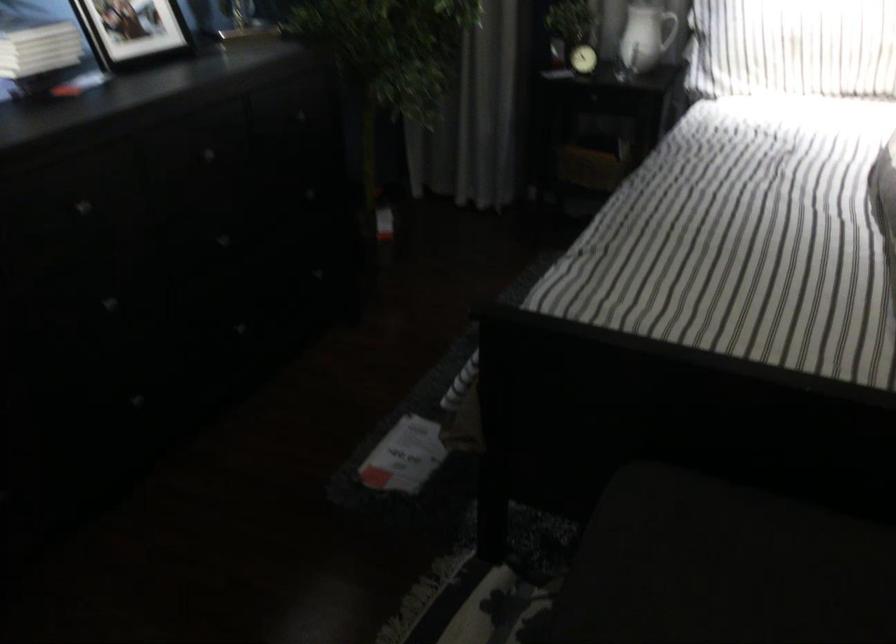
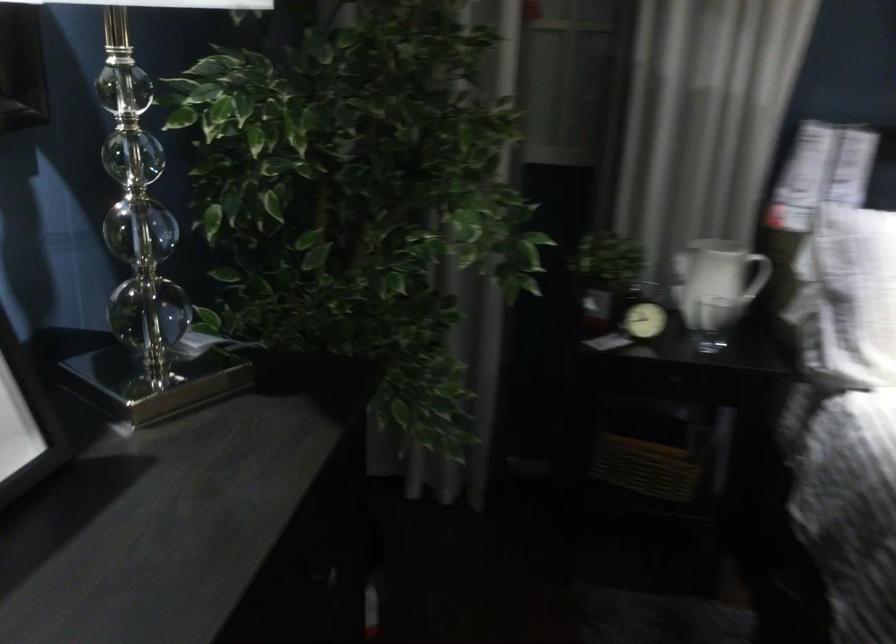
Find the pixel in the second image that matches pixel 588 162 in the first image.

(645, 467)